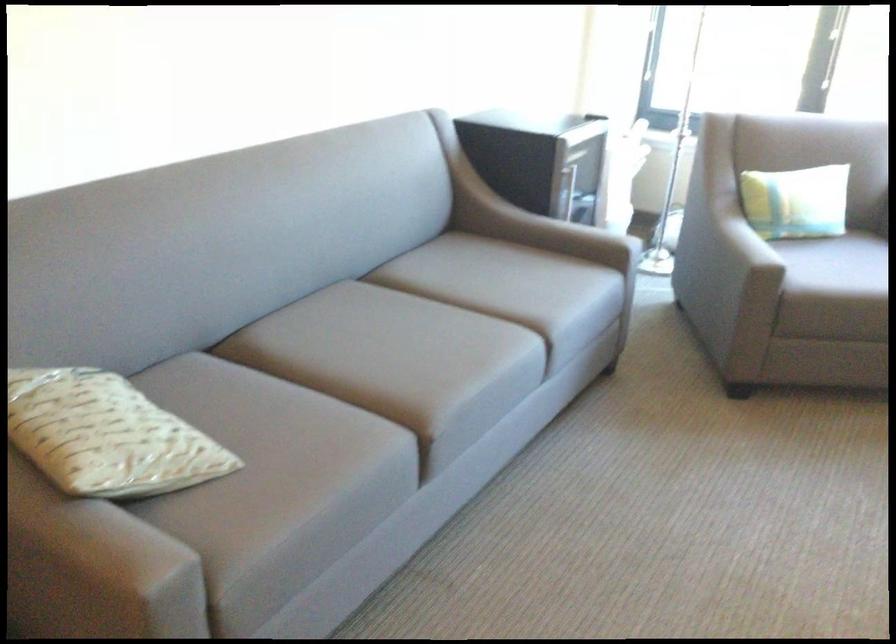
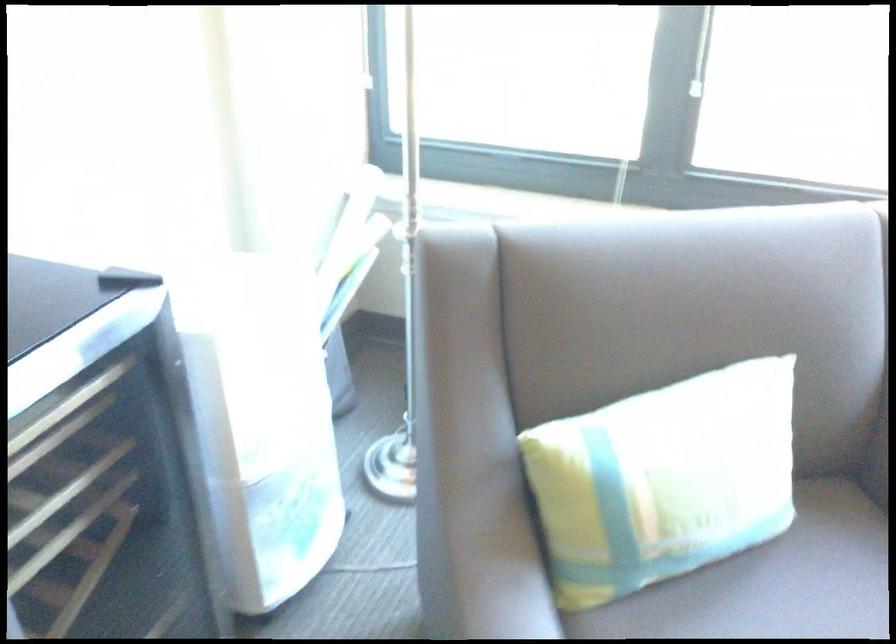
Which direction would the cameraman need to move to produce the second image?

The cameraman walked toward right, forward.